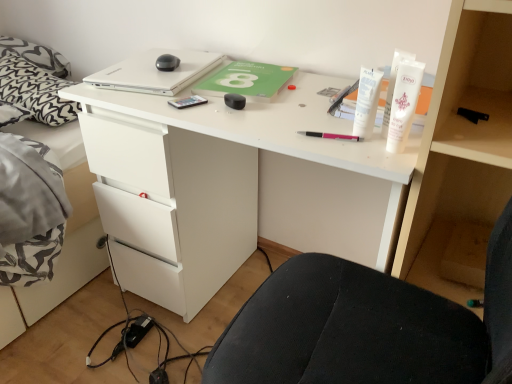
The height and width of the screenshot is (384, 512). In order to click on free location to the left of white matte tube at upper right, which is the first toiletry from right to left in this screenshot , I will do `click(320, 140)`.